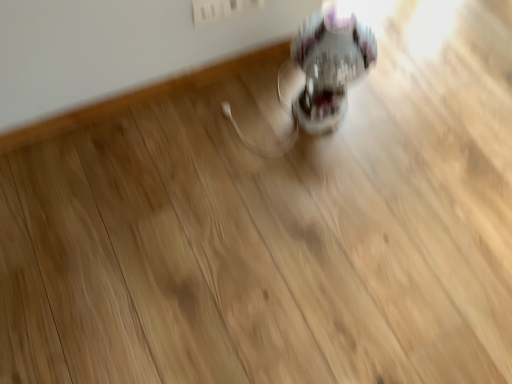
Locate an element on the screen. translucent plastic swivel chair at center is located at coordinates (329, 65).

Measure the distance between point (329, 77) and camera.

They are 1.16 meters apart.

This screenshot has width=512, height=384. What do you see at coordinates (329, 65) in the screenshot?
I see `translucent plastic swivel chair at center` at bounding box center [329, 65].

This screenshot has width=512, height=384. Identify the location of translucent plastic swivel chair at center. (329, 65).